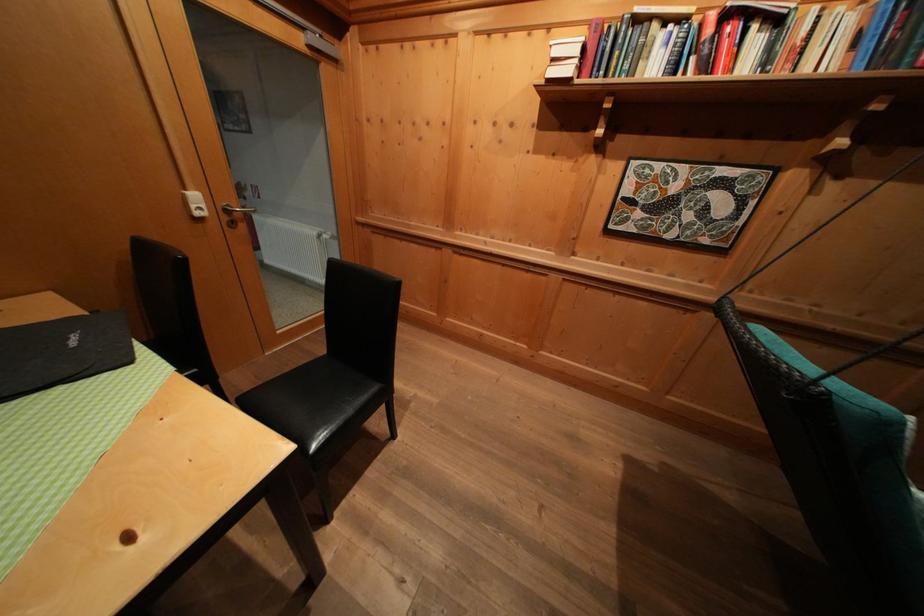
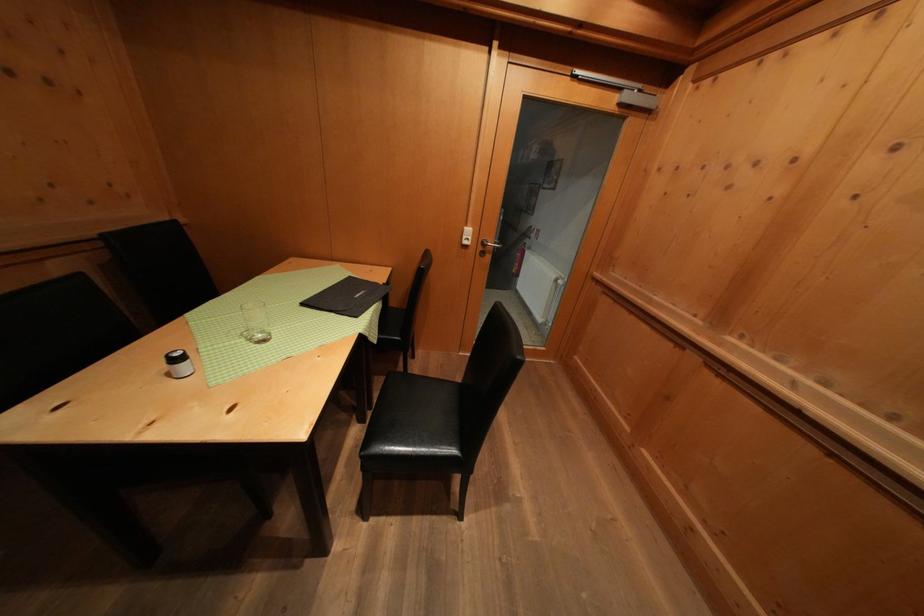
Find the pixel in the second image that matches [235,217] in the first image.

(490, 249)